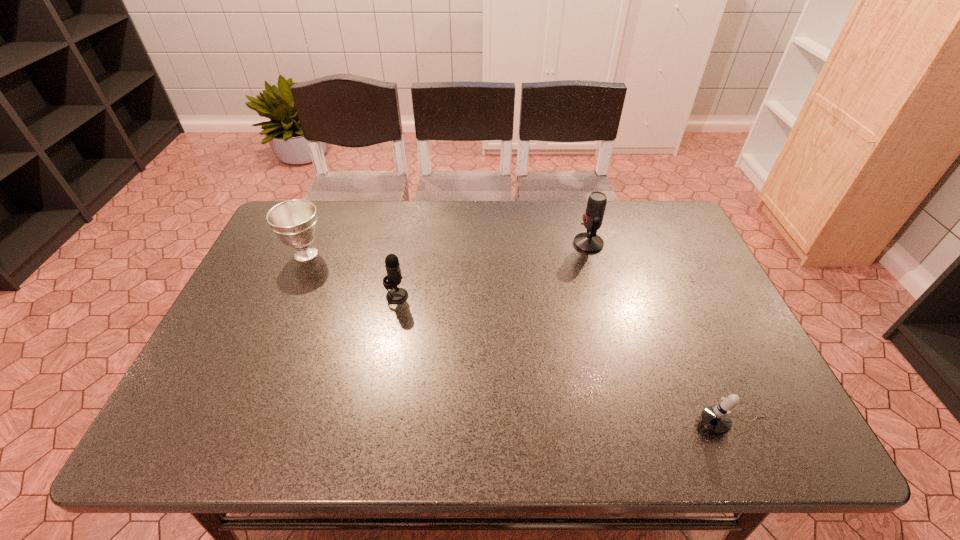
You are a GUI agent. You are given a task and a screenshot of the screen. Output one action in this format:
    pyautogui.click(x=<x>, y=<y>)
    Task: Click on the third object from left to right
    This screenshot has height=540, width=960.
    Given the screenshot: What is the action you would take?
    pyautogui.click(x=589, y=242)

You are a GUI agent. You are given a task and a screenshot of the screen. Output one action in this format:
    pyautogui.click(x=<x>, y=<y>)
    Task: Click on the farthest microphone
    Image resolution: width=960 pixels, height=540 pixels.
    Given the screenshot: What is the action you would take?
    pyautogui.click(x=589, y=242)

At what (x,y) coordinates should I click in order to perform the action: click on chalice. Please return your answer as a coordinate pair (x, y). Looking at the image, I should click on (294, 222).

Where is `the third object from right to left`? This screenshot has height=540, width=960. the third object from right to left is located at coordinates (396, 295).

At what (x,y) coordinates should I click in order to perform the action: click on the leftmost microphone. Please return your answer as a coordinate pair (x, y). This screenshot has width=960, height=540. Looking at the image, I should click on (396, 295).

You are a GUI agent. You are given a task and a screenshot of the screen. Output one action in this format:
    pyautogui.click(x=<x>, y=<y>)
    Task: Click on the nearest object
    The height and width of the screenshot is (540, 960).
    Given the screenshot: What is the action you would take?
    pyautogui.click(x=716, y=419)

The height and width of the screenshot is (540, 960). Find the location of `the rightmost microphone`. the rightmost microphone is located at coordinates (716, 419).

Locate an element on the screen. free space located on the side of the farthest microphone with the red ring is located at coordinates (521, 244).

Locate an element on the screen. free space located 0.300m on the side of the farthest microphone with the red ring is located at coordinates (475, 244).

At what (x,y) coordinates should I click in order to perform the action: click on vacant space located on the side of the farthest microphone with the red ring. Please return your answer as a coordinate pair (x, y). This screenshot has height=540, width=960. Looking at the image, I should click on (449, 244).